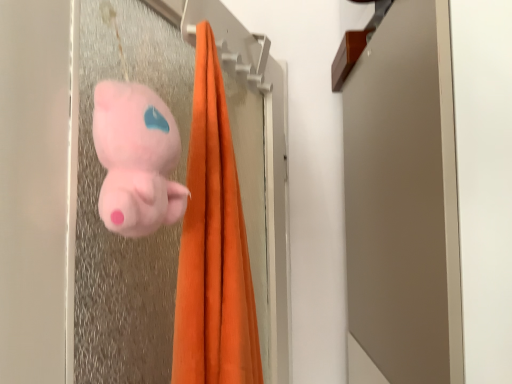
Question: Does matte plastic screen door at upper center appear on the right side of fluffy pink plush at center?

Choices:
 (A) no
 (B) yes

Answer: (B)

Question: Is matte plastic screen door at upper center outside fluffy pink plush at center?

Choices:
 (A) no
 (B) yes

Answer: (B)

Question: Does matte plastic screen door at upper center have a smaller size compared to fluffy pink plush at center?

Choices:
 (A) no
 (B) yes

Answer: (A)

Question: From the image's perspective, is matte plastic screen door at upper center located above fluffy pink plush at center?

Choices:
 (A) yes
 (B) no

Answer: (B)

Question: Are matte plastic screen door at upper center and fluffy pink plush at center making contact?

Choices:
 (A) no
 (B) yes

Answer: (A)

Question: Can you confirm if matte plastic screen door at upper center is wider than fluffy pink plush at center?

Choices:
 (A) yes
 (B) no

Answer: (A)

Question: Does fluffy pink plush at center contain matte plastic screen door at upper center?

Choices:
 (A) yes
 (B) no

Answer: (B)

Question: From a real-world perspective, is fluffy pink plush at center on top of matte plastic screen door at upper center?

Choices:
 (A) yes
 (B) no

Answer: (A)

Question: Is fluffy pink plush at center oriented away from matte plastic screen door at upper center?

Choices:
 (A) yes
 (B) no

Answer: (A)

Question: Considering the relative positions of fluffy pink plush at center and matte plastic screen door at upper center in the image provided, is fluffy pink plush at center in front of matte plastic screen door at upper center?

Choices:
 (A) yes
 (B) no

Answer: (B)

Question: From a real-world perspective, is fluffy pink plush at center physically below matte plastic screen door at upper center?

Choices:
 (A) yes
 (B) no

Answer: (B)

Question: From the image's perspective, would you say fluffy pink plush at center is positioned over matte plastic screen door at upper center?

Choices:
 (A) yes
 (B) no

Answer: (A)

Question: Is matte plastic screen door at upper center in front of or behind fluffy pink plush at center in the image?

Choices:
 (A) behind
 (B) front

Answer: (B)